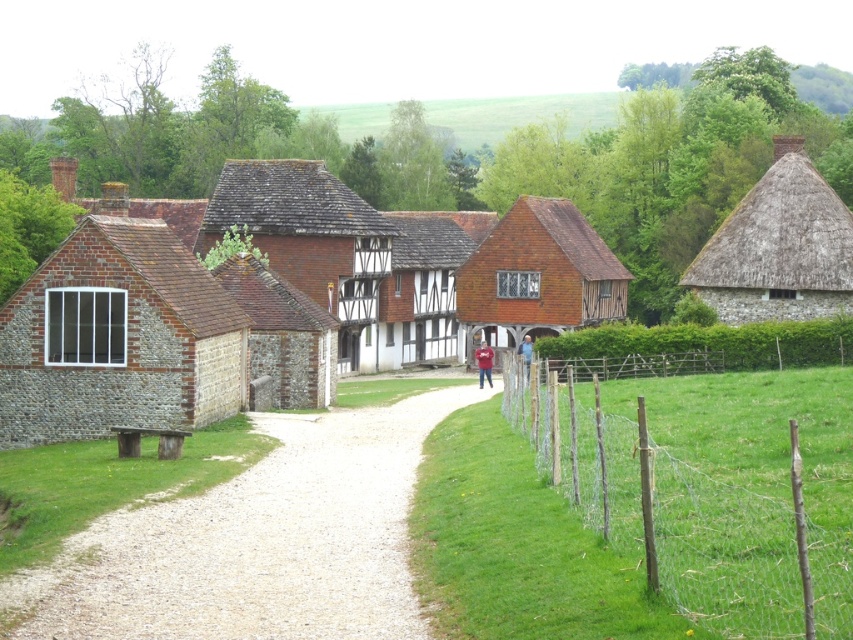
Between brown thatched roof at center and thatched roof cottage at right, which one has more height?

brown thatched roof at center is taller.

Does point (355, 301) lie behind point (782, 145)?

Yes, point (355, 301) is farther from viewer.

What do you see at coordinates (309, 237) in the screenshot? I see `brown thatched roof at center` at bounding box center [309, 237].

Locate an element on the screen. The width and height of the screenshot is (853, 640). brown thatched roof at center is located at coordinates (309, 237).

Is brick wall at center thinner than matte red shirt at center?

Incorrect, brick wall at center's width is not less than matte red shirt at center's.

Image resolution: width=853 pixels, height=640 pixels. What do you see at coordinates (283, 333) in the screenshot?
I see `brick wall at center` at bounding box center [283, 333].

This screenshot has width=853, height=640. I want to click on brick wall at center, so click(x=283, y=333).

Does point (277, 179) come closer to viewer compared to point (608, 316)?

Yes, point (277, 179) is closer to viewer.

Image resolution: width=853 pixels, height=640 pixels. Describe the element at coordinates (309, 237) in the screenshot. I see `brown thatched roof at center` at that location.

Find the location of a particular element. Image resolution: width=853 pixels, height=640 pixels. brown thatched roof at center is located at coordinates (x=309, y=237).